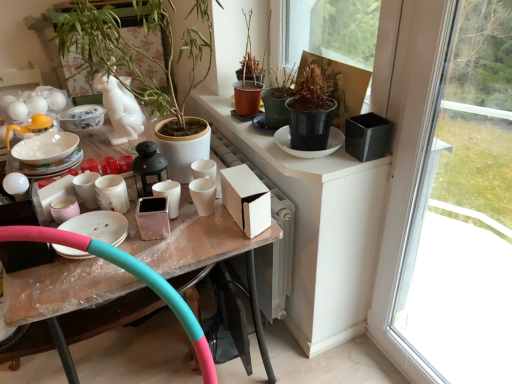
Question: Which direction should I rotate to face terracotta pot at upper center, which appears as the second houseplant when viewed from the left, — up or down?

Choices:
 (A) down
 (B) up

Answer: (B)

Question: Can you confirm if matte pink ceramic cup at center, marked as the 1th tableware in a right-to-left arrangement, is wider than pink rubber hula hoop at lower left?

Choices:
 (A) yes
 (B) no

Answer: (B)

Question: Is matte pink ceramic cup at center, marked as the 1th tableware in a right-to-left arrangement, smaller than pink rubber hula hoop at lower left?

Choices:
 (A) yes
 (B) no

Answer: (A)

Question: Is matte pink ceramic cup at center, the third tableware from the left, looking in the opposite direction of pink rubber hula hoop at lower left?

Choices:
 (A) no
 (B) yes

Answer: (A)

Question: Considering the relative sizes of matte pink ceramic cup at center, the third tableware from the left, and pink rubber hula hoop at lower left in the image provided, is matte pink ceramic cup at center, the third tableware from the left, shorter than pink rubber hula hoop at lower left?

Choices:
 (A) yes
 (B) no

Answer: (A)

Question: Considering the relative sizes of matte pink ceramic cup at center, marked as the 1th tableware in a right-to-left arrangement, and pink rubber hula hoop at lower left in the image provided, is matte pink ceramic cup at center, marked as the 1th tableware in a right-to-left arrangement, bigger than pink rubber hula hoop at lower left?

Choices:
 (A) no
 (B) yes

Answer: (A)

Question: From the image's perspective, is matte pink ceramic cup at center, the third tableware from the left, above pink rubber hula hoop at lower left?

Choices:
 (A) yes
 (B) no

Answer: (A)

Question: Considering the relative sizes of pink rubber hula hoop at lower left and matte pink ceramic cup at center, the third tableware from the left, in the image provided, is pink rubber hula hoop at lower left smaller than matte pink ceramic cup at center, the third tableware from the left,?

Choices:
 (A) yes
 (B) no

Answer: (B)

Question: Considering the relative sizes of pink rubber hula hoop at lower left and matte pink ceramic cup at center, the third tableware from the left, in the image provided, is pink rubber hula hoop at lower left taller than matte pink ceramic cup at center, the third tableware from the left,?

Choices:
 (A) no
 (B) yes

Answer: (B)

Question: Would you say pink rubber hula hoop at lower left is outside matte pink ceramic cup at center, marked as the 1th tableware in a right-to-left arrangement?

Choices:
 (A) no
 (B) yes

Answer: (B)

Question: Is pink rubber hula hoop at lower left closer to camera compared to matte pink ceramic cup at center, marked as the 1th tableware in a right-to-left arrangement?

Choices:
 (A) no
 (B) yes

Answer: (B)

Question: Are pink rubber hula hoop at lower left and matte pink ceramic cup at center, the third tableware from the left, making contact?

Choices:
 (A) yes
 (B) no

Answer: (B)

Question: Can you confirm if pink rubber hula hoop at lower left is bigger than matte pink ceramic cup at center, the third tableware from the left?

Choices:
 (A) yes
 (B) no

Answer: (A)

Question: From the image's perspective, would you say matte white teapot at upper left is positioned over pink rubber garden hose at lower left?

Choices:
 (A) yes
 (B) no

Answer: (A)